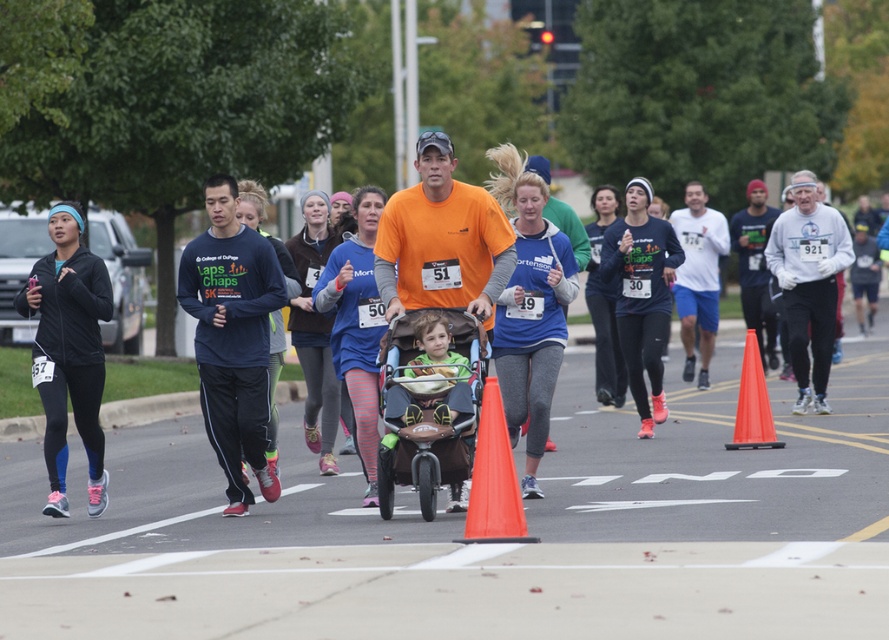
You are a participant in the community running event and you see two points marked on the road ahead. The first point is at coordinates point (91, 330) and the second point is at point (421, 339). Based on the scene, which point is closer to you as you run forward?

Point (91, 330) is behind point (421, 339), so the closer point to you as you run forward is point (421, 339).

You are a participant in the community running event and want to know if the point at coordinate (268, 330) is ahead of the point at coordinate (749, 337) along the running path. Can you confirm this?

Yes, the point at coordinate (268, 330) is in front of the point at coordinate (749, 337) along the running path.